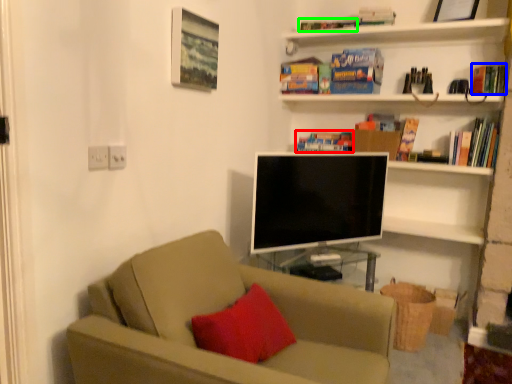
Question: Which object is positioned closest to book (highlighted by a red box)? Select from book (highlighted by a blue box) and book (highlighted by a green box).

Choices:
 (A) book
 (B) book

Answer: (B)